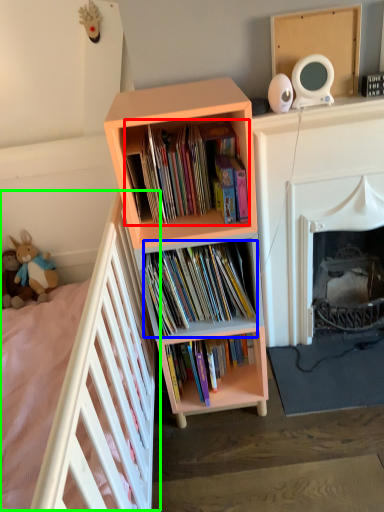
Question: Estimate the real-world distances between objects in this image. Which object is farther from book (highlighted by a red box), book (highlighted by a blue box) or bed (highlighted by a green box)?

Choices:
 (A) book
 (B) bed

Answer: (B)